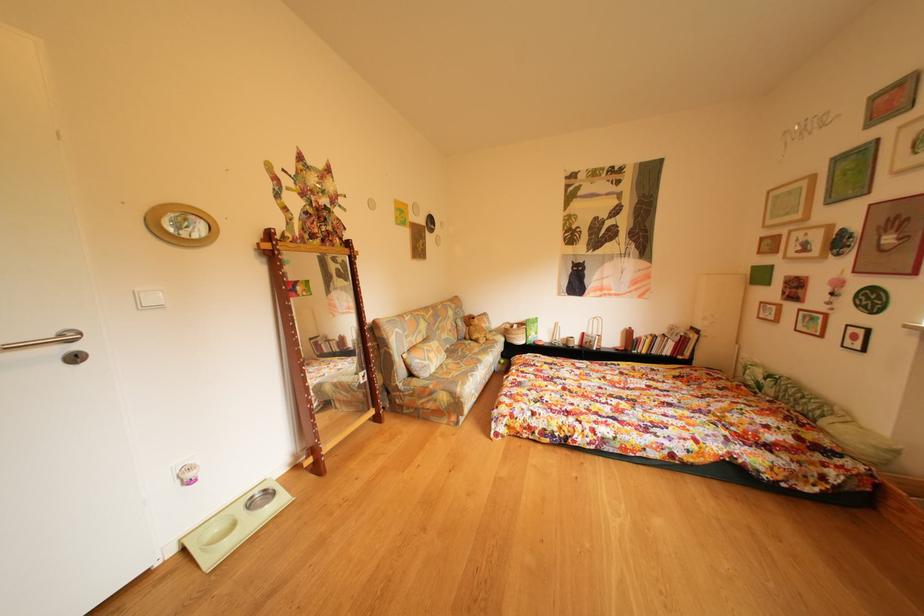
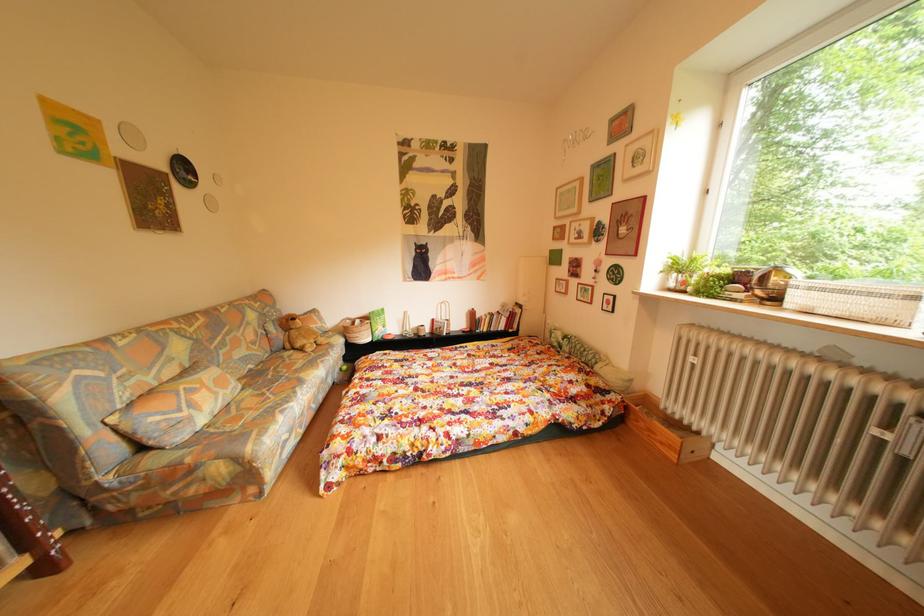
Question: Based on the continuous images, in which direction is the camera rotating? Reply with the corresponding letter.

Choices:
 (A) Left
 (B) Right
 (C) Up
 (D) Down

Answer: (B)